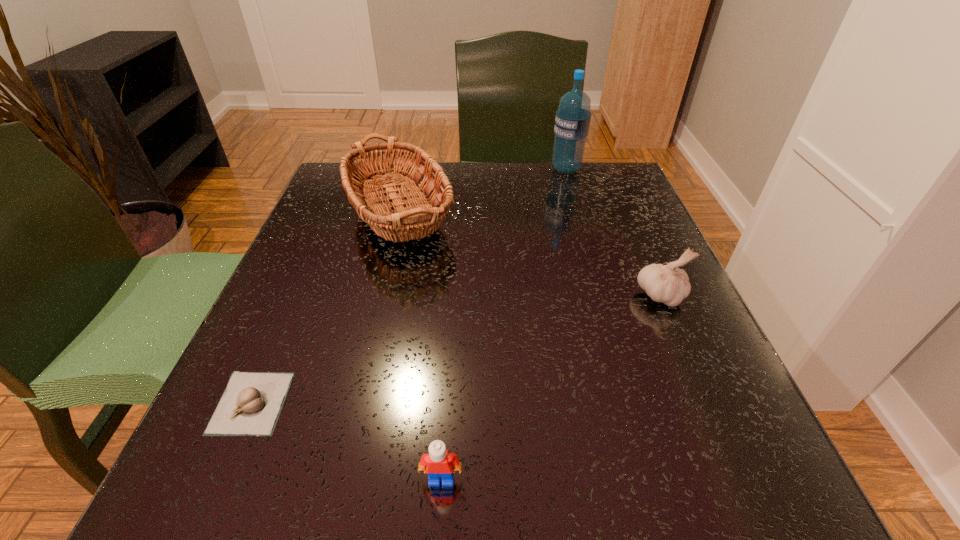
Identify the location of vacant region located 0.050m on the back of the second tallest object. This screenshot has height=540, width=960. tap(413, 164).

I want to click on vacant position located 0.340m on the back of the taller garlic, so click(612, 185).

Image resolution: width=960 pixels, height=540 pixels. Identify the location of vacant area situated on the right of the nearer garlic. 413,403.

The height and width of the screenshot is (540, 960). I want to click on water bottle that is at the far edge, so click(x=572, y=122).

Find the location of `basket that is at the far edge`. basket that is at the far edge is located at coordinates (412, 219).

This screenshot has height=540, width=960. Find the location of `object positioned at the near edge`. object positioned at the near edge is located at coordinates (439, 462).

Identify the location of basket positioned at the left edge. (412, 219).

Image resolution: width=960 pixels, height=540 pixels. What are the coordinates of `garlic situated at the left edge` in the screenshot? It's located at (x=251, y=403).

Where is `water bottle situated at the right edge`? water bottle situated at the right edge is located at coordinates (572, 122).

Locate an element on the screen. garlic located at the right edge is located at coordinates (666, 283).